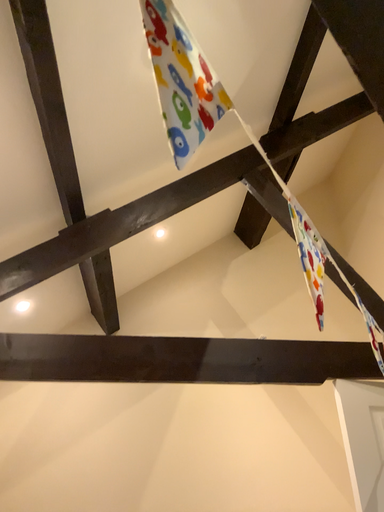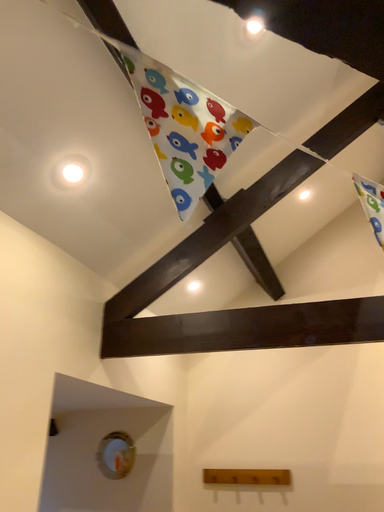
Question: Which way did the camera rotate in the video?

Choices:
 (A) rotated upward
 (B) rotated downward

Answer: (B)